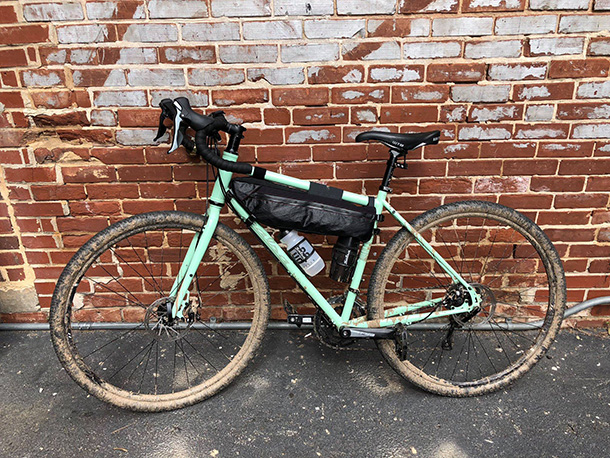
The image size is (610, 458). What are the coordinates of `brick wall` in the screenshot? It's located at (302, 121), (10, 246), (601, 233).